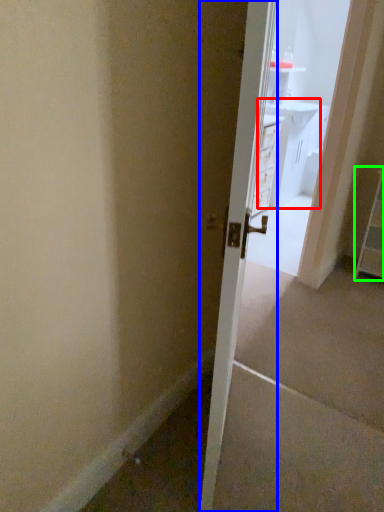
Question: Which object is positioned closest to vanity (highlighted by a red box)? Select from door (highlighted by a blue box) and dresser (highlighted by a green box).

Choices:
 (A) door
 (B) dresser

Answer: (B)